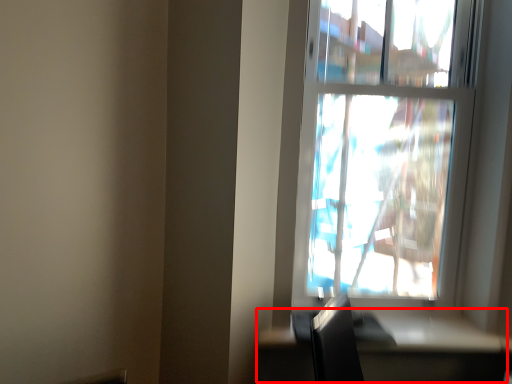
Question: From the image's perspective, what is the correct spatial positioning of table (annotated by the red box) in reference to window?

Choices:
 (A) above
 (B) below

Answer: (B)